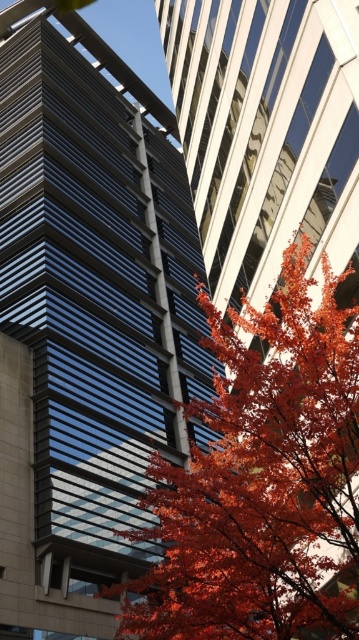
You are an architect designing a new building. You want to ensure that the view of the shiny red leaves at center is visible from the smooth glass tower at center. Based on the image, is this possible?

The shiny red leaves at center is behind the smooth glass tower at center, so the view of the shiny red leaves at center would be blocked by the tower itself. Therefore, the view of the shiny red leaves at center is not visible from the smooth glass tower at center.

You are an architect evaluating the balance between the urban and natural elements in the scene. Given the sizes of the smooth glass tower at center and the shiny red leaves at center, which element do you think dominates the visual composition?

The smooth glass tower at center is larger in size than the shiny red leaves at center, so the urban element dominates the visual composition.

You are standing at the point marked as point [86,317]. Which object is directly in front of you?

The smooth glass tower at center is located at point [86,317], so it is directly in front of you.